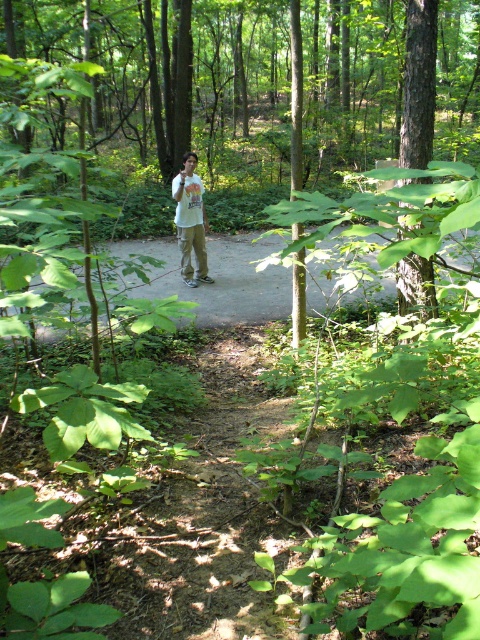
Question: Among these points, which one is nearest to the camera?

Choices:
 (A) (232, 304)
 (B) (208, 282)

Answer: (A)

Question: Can you confirm if dirt path at center is positioned to the left of white cotton shirt at center?

Choices:
 (A) no
 (B) yes

Answer: (A)

Question: Where is dirt path at center located in relation to white cotton shirt at center in the image?

Choices:
 (A) right
 (B) left

Answer: (A)

Question: Is dirt path at center to the left of white cotton shirt at center from the viewer's perspective?

Choices:
 (A) no
 (B) yes

Answer: (A)